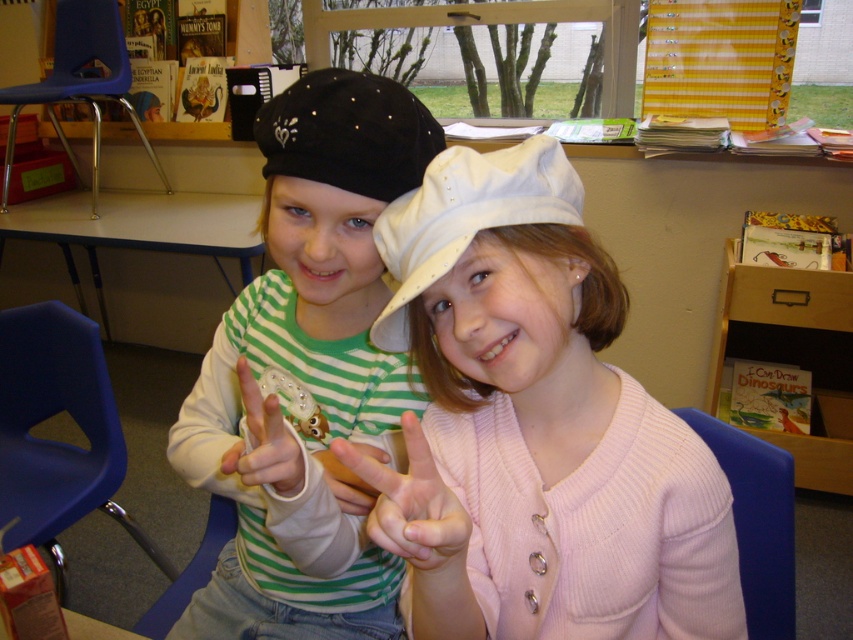
You are a photographer setting up for a school photo. You notice two hats in the scene, the white knit hat at center and the black suede baseball hat at upper center. To ensure both hats are in frame, what is the minimum distance in inches you should keep between the edges of your camera frame?

The minimum distance needed between the edges of the camera frame should be at least 9.68 inches to ensure both the white knit hat at center and the black suede baseball hat at upper center are fully visible, as they are 9.68 inches apart.

You are a photographer trying to capture a clear shot of both the black suede baseball hat at upper center and the pink fabric hand at center in the image. Since you want both objects to appear equally prominent in the photo, which object should you zoom in on more, and why?

The black suede baseball hat at upper center has a smaller size compared to the pink fabric hand at center. To make them appear equally prominent, you should zoom in more on the black suede baseball hat at upper center because it is smaller and needs to be enlarged to match the size of the pink fabric hand at center.